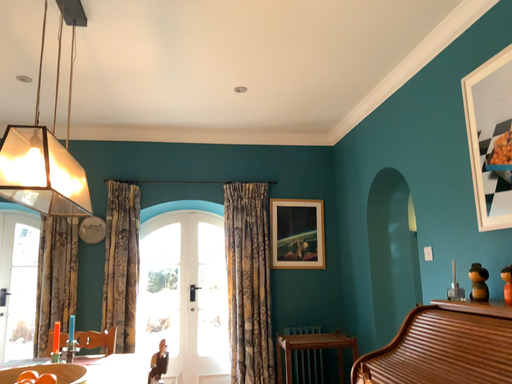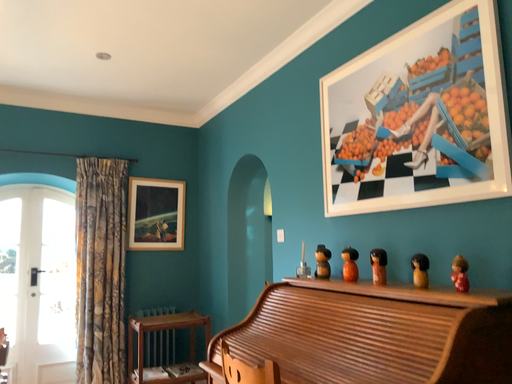
Question: How did the camera likely rotate when shooting the video?

Choices:
 (A) rotated right
 (B) rotated left

Answer: (A)